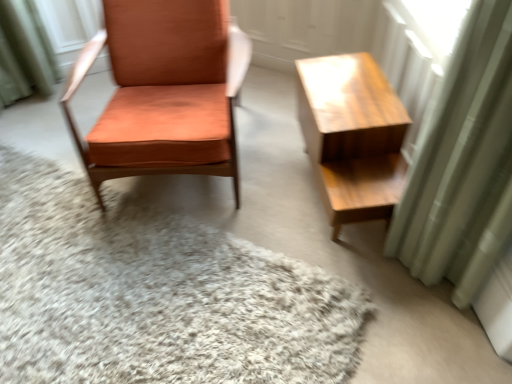
I want to click on vacant area on top of white shaggy rug at center (from a real-world perspective), so click(x=130, y=288).